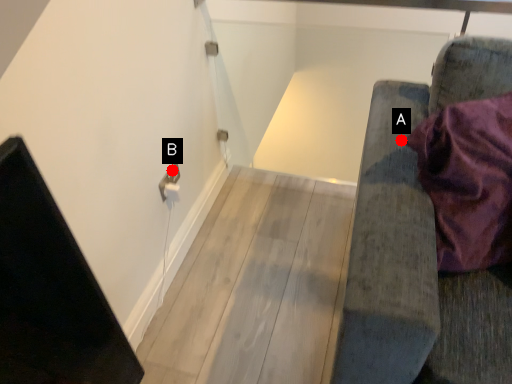
Question: Two points are circled on the image, labeled by A and B beside each circle. Which point is closer to the camera?

Choices:
 (A) A is closer
 (B) B is closer

Answer: (A)